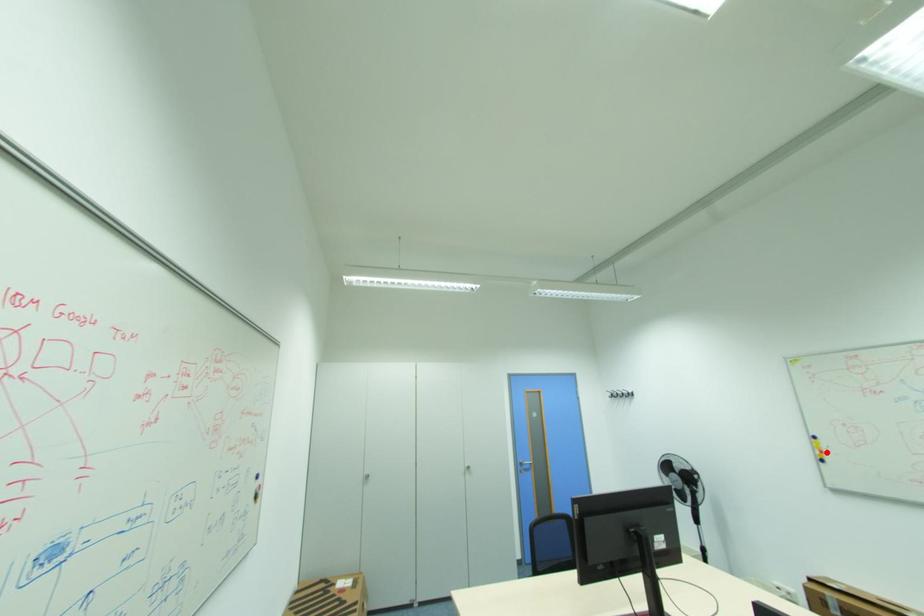
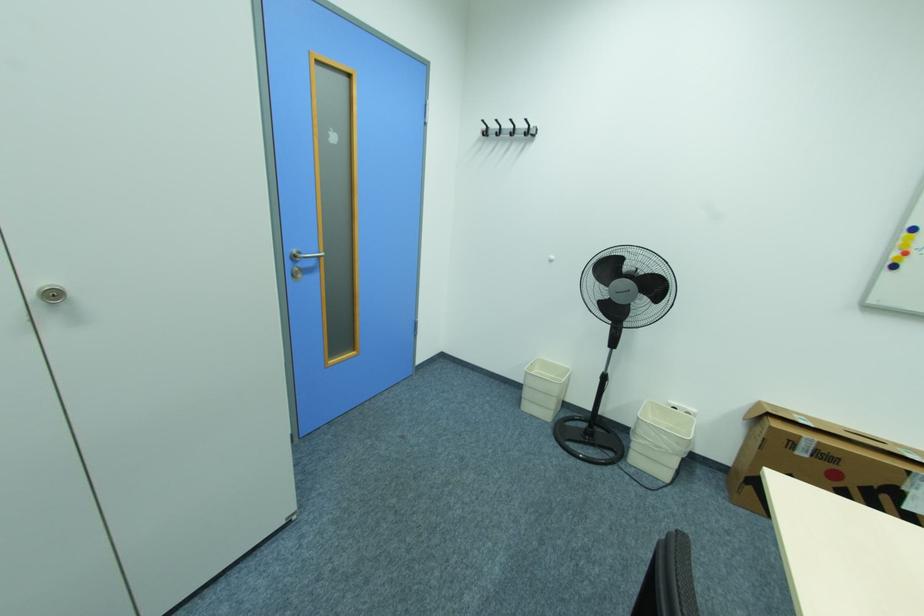
Question: I am providing you with two images of the same scene from different viewpoints. Image1 has a red point marked. In image2, the corresponding 3D location appears at what relative position? Reply with the corresponding letter.

Choices:
 (A) Closer
 (B) Farther

Answer: (B)